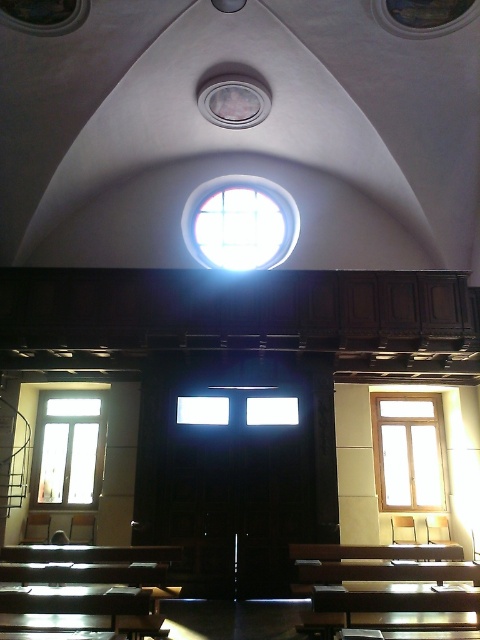
Is point (420, 417) positioned behind point (71, 496)?

Yes.

Between clear glass window at right and clear glass window at left, which one is positioned lower?

Positioned lower is clear glass window at right.

From the picture: Who is more distant from viewer, (388, 396) or (87, 445)?

The point (388, 396) is behind.

Where is `clear glass window at right`? Image resolution: width=480 pixels, height=640 pixels. clear glass window at right is located at coordinates click(x=408, y=451).

Which is in front, point (188, 243) or point (379, 394)?

Point (379, 394) is in front.

Is clear glass window at center in front of clear glass window at right?

No, clear glass window at center is further to the viewer.

Identify the location of clear glass window at center. (240, 224).

This screenshot has width=480, height=640. What are the coordinates of `clear glass window at center` in the screenshot? It's located at (240, 224).

Measure the distance between clear glass window at center and camera.

11.77 meters

Is point (274, 184) farther from camera compared to point (54, 458)?

That is True.

I want to click on clear glass window at center, so click(x=240, y=224).